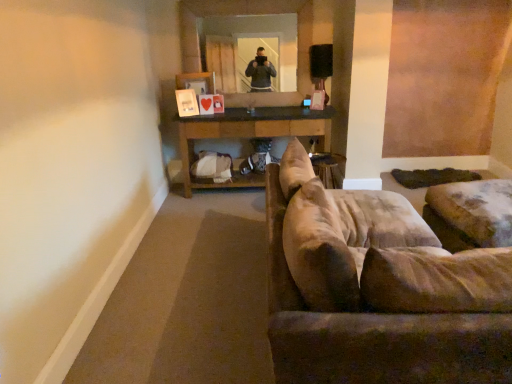
At what (x,y) coordinates should I click in order to perform the action: click on vacant space situated above brown wooden table at center (from a real-world perspective). Please return your answer as a coordinate pair (x, y). Image resolution: width=512 pixels, height=384 pixels. Looking at the image, I should click on (267, 108).